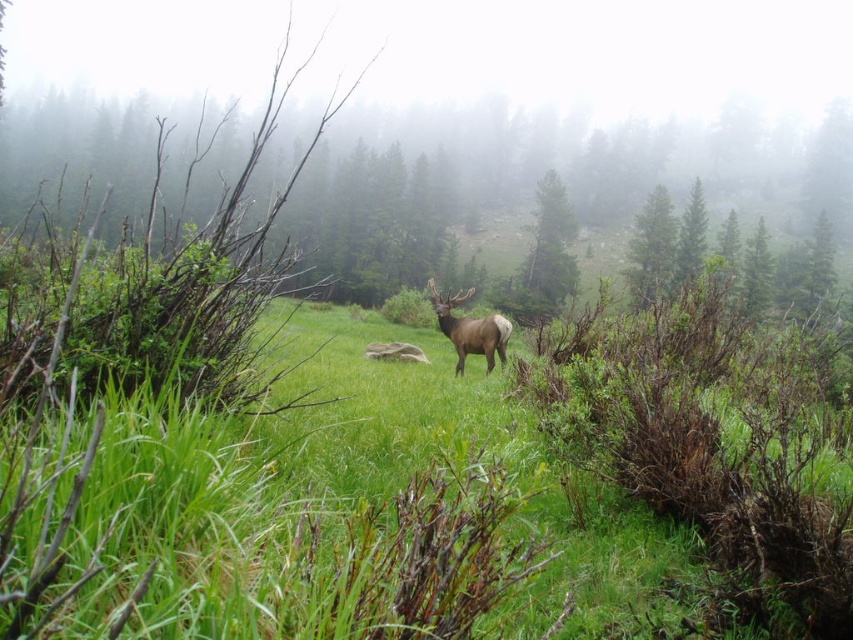
How far apart are green leafy tree at upper center and brown velvet deer at center?

They are 85.45 feet apart.

The height and width of the screenshot is (640, 853). What do you see at coordinates (651, 248) in the screenshot?
I see `green leafy tree at upper center` at bounding box center [651, 248].

At what (x,y) coordinates should I click in order to perform the action: click on green leafy tree at upper center. Please return your answer as a coordinate pair (x, y). This screenshot has width=853, height=640. Looking at the image, I should click on (651, 248).

Who is taller, green grassy at center or brown velvet deer at center?

Standing taller between the two is brown velvet deer at center.

Looking at this image, who is more forward, (792, 504) or (459, 364)?

Point (792, 504) is more forward.

This screenshot has width=853, height=640. What do you see at coordinates (410, 515) in the screenshot?
I see `green grassy at center` at bounding box center [410, 515].

I want to click on green grassy at center, so click(410, 515).

Which is above, green textured pine tree at center or brown velvet deer at center?

green textured pine tree at center is above.

Is point (558, 202) behind point (491, 368)?

Yes, point (558, 202) is farther from viewer.

The width and height of the screenshot is (853, 640). In order to click on green textured pine tree at center in this screenshot , I will do `click(550, 248)`.